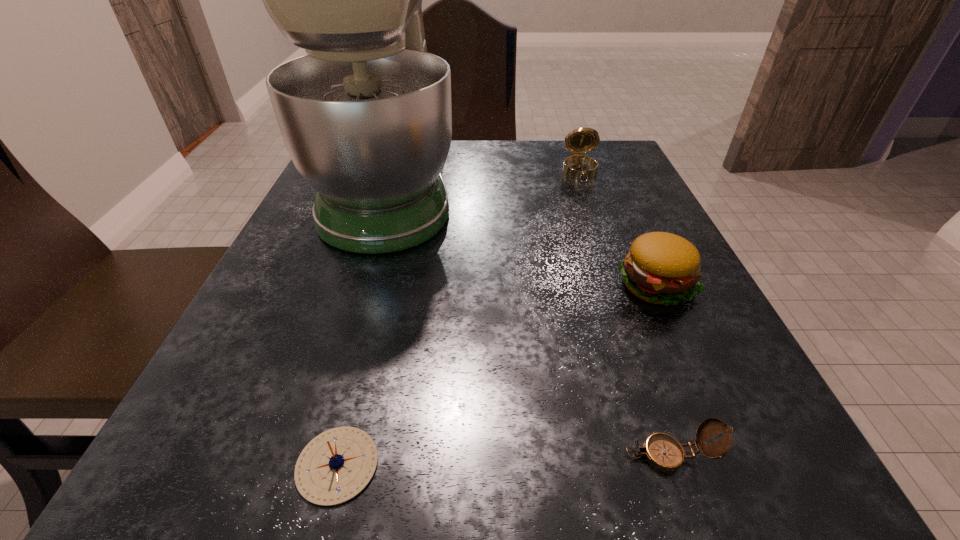
Locate an element on the screen. free point that satisfies the following two spatial constraints: 1. with the dial facing the third nearest object; 2. on the left side of the tallest compass is located at coordinates (621, 286).